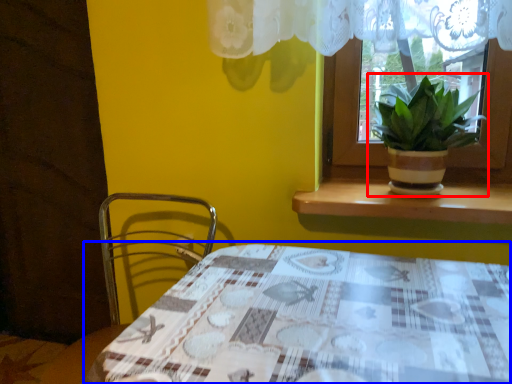
Question: Which point is closer to the camera, houseplant (highlighted by a red box) or table (highlighted by a blue box)?

Choices:
 (A) houseplant
 (B) table

Answer: (B)